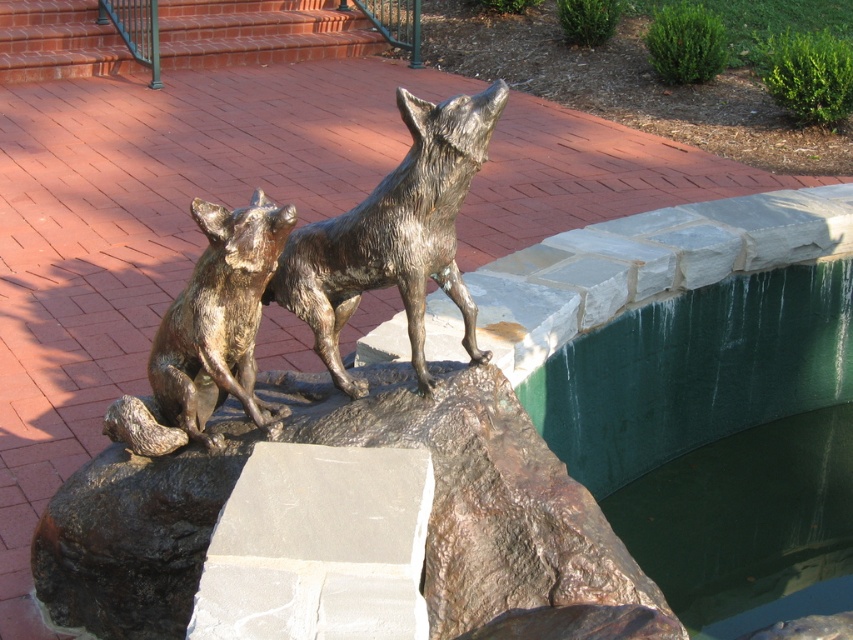
Question: Is bronze/statue at center to the left of bronze statue of dog at center from the viewer's perspective?

Choices:
 (A) no
 (B) yes

Answer: (A)

Question: Based on their relative distances, which object is nearer to the bronze/statue at center?

Choices:
 (A) green concrete water at upper right
 (B) bronze statue of dog at center

Answer: (B)

Question: Among these objects, which one is farthest from the camera?

Choices:
 (A) bronze/statue at center
 (B) bronze statue of dog at center
 (C) green concrete water at upper right

Answer: (C)

Question: Which object is closer to the camera taking this photo?

Choices:
 (A) bronze statue of dog at center
 (B) green concrete water at upper right

Answer: (A)

Question: Does bronze/statue at center have a lesser width compared to bronze statue of dog at center?

Choices:
 (A) yes
 (B) no

Answer: (B)

Question: Where is green concrete water at upper right located in relation to bronze statue of dog at center in the image?

Choices:
 (A) below
 (B) above

Answer: (A)